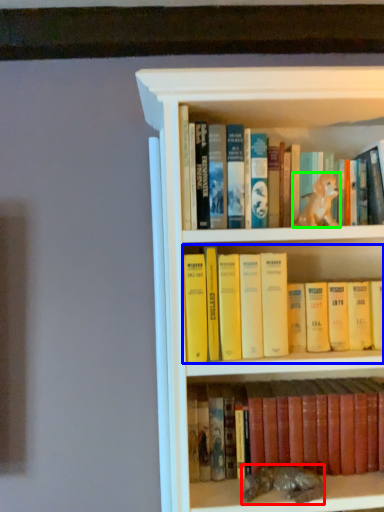
Question: Based on their relative distances, which object is farther from animal (highlighted by a red box)? Choose from book (highlighted by a blue box) and animal (highlighted by a green box).

Choices:
 (A) book
 (B) animal

Answer: (B)